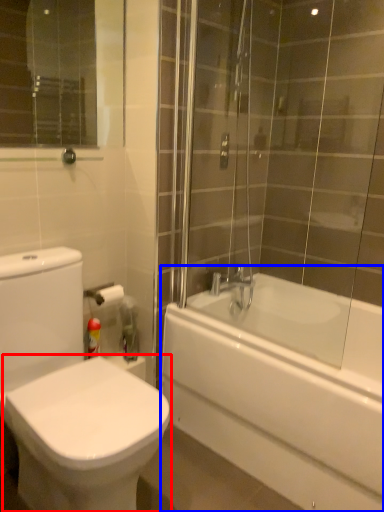
Question: Which of the following is the closest to the observer, bidet (highlighted by a red box) or bathtub (highlighted by a blue box)?

Choices:
 (A) bidet
 (B) bathtub

Answer: (A)